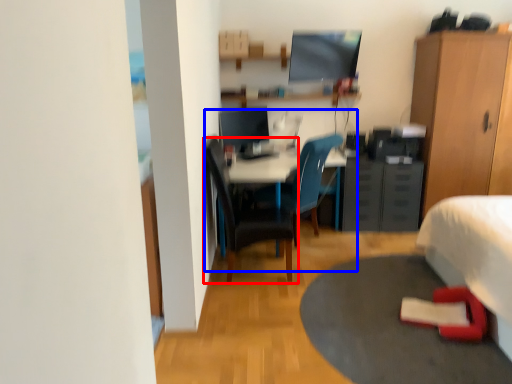
Question: Which of the following is the closest to the observer, chair (highlighted by a red box) or computer desk (highlighted by a blue box)?

Choices:
 (A) chair
 (B) computer desk

Answer: (A)